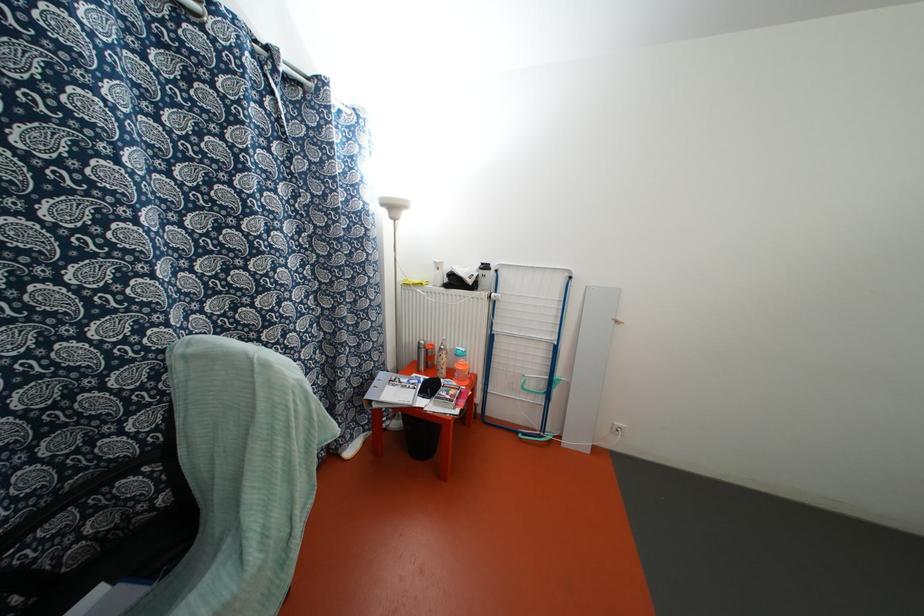
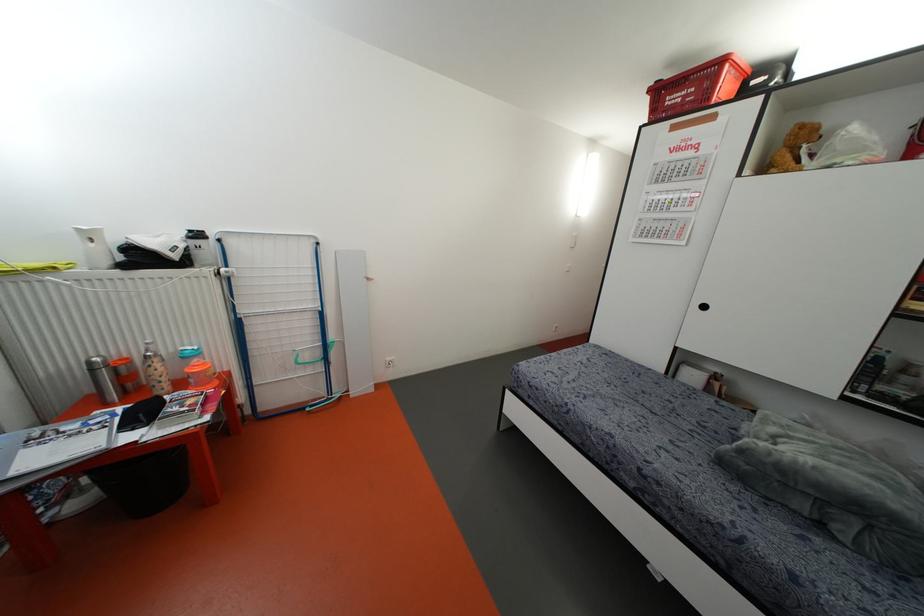
Locate, in the second image, the point that corresponds to [444,352] in the first image.

(155, 360)